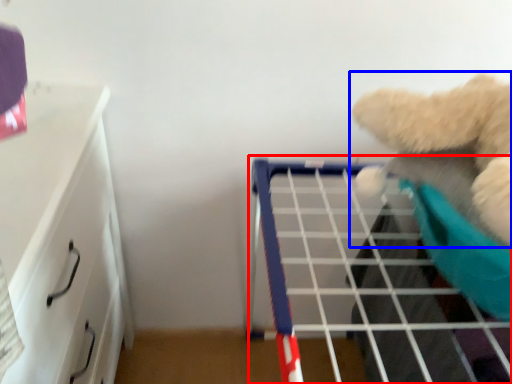
Question: Among these objects, which one is farthest to the camera, shelf (highlighted by a red box) or teddy bear (highlighted by a blue box)?

Choices:
 (A) shelf
 (B) teddy bear

Answer: (A)